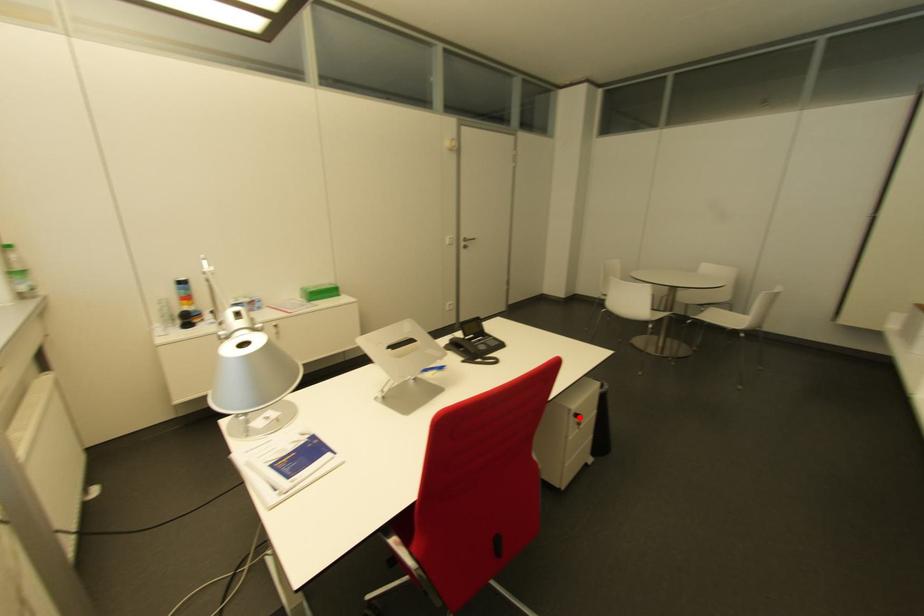
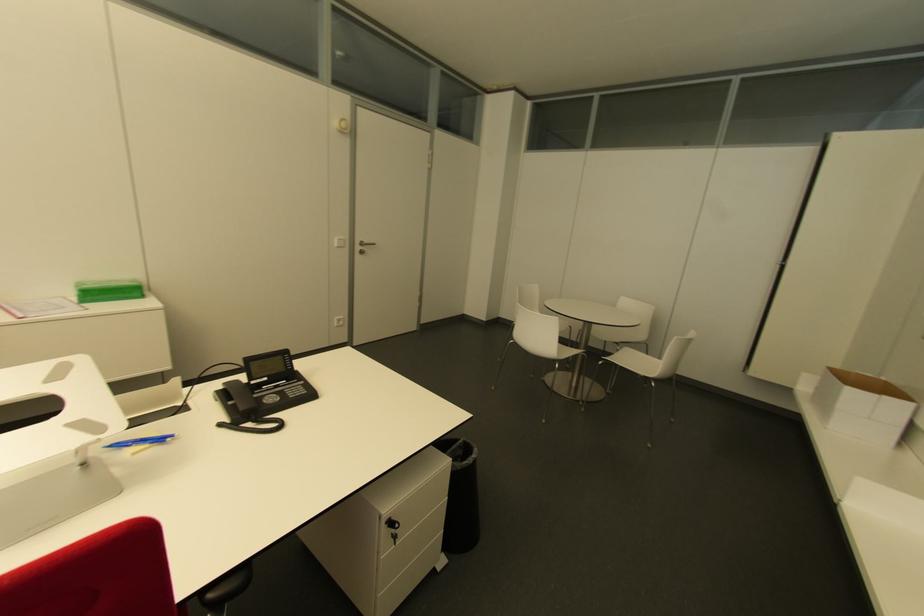
In the second image, find the point that corresponds to the highlighted location in the first image.

(394, 525)